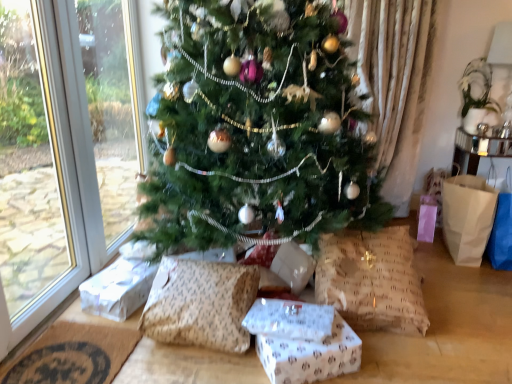
The height and width of the screenshot is (384, 512). I want to click on free space above white paper gift at center, placed as the first gift box when sorted from right to left (from a real-world perspective), so click(315, 342).